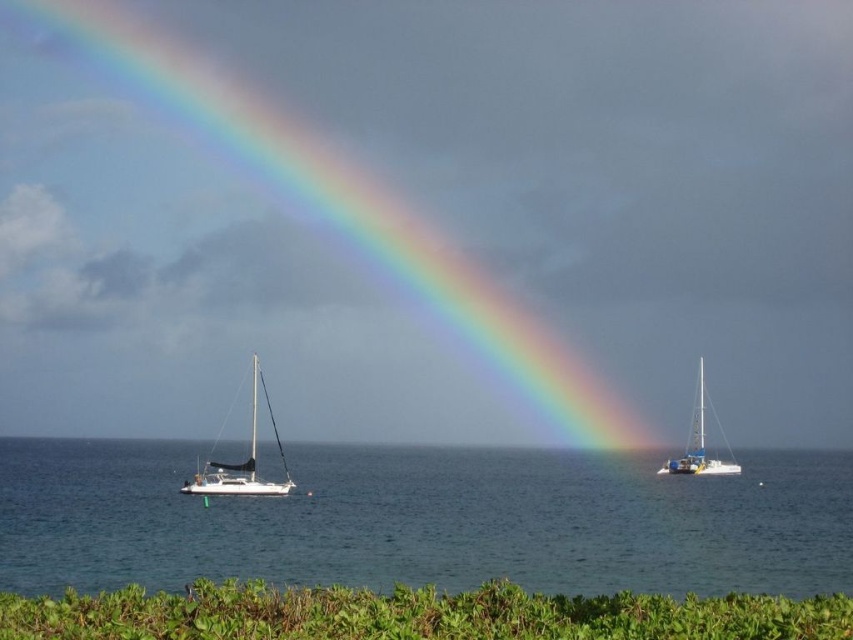
You are a sailor on a ship that requires a minimum of 300 feet of open space to maneuver safely. You see the green leafy vegetation at lower center and the white glossy sailboat at center. Is there enough space between them to navigate safely?

The distance between the green leafy vegetation at lower center and the white glossy sailboat at center is 274.24 feet, which is less than the required 300 feet. Therefore, there is not enough space to navigate safely between them.

You are standing on a cliff overlooking the seascape. You notice both the clear blue water at lower center and the green leafy vegetation at lower center. Which one appears closer to you?

The clear blue water at lower center appears closer because the green leafy vegetation at lower center is positioned behind it.